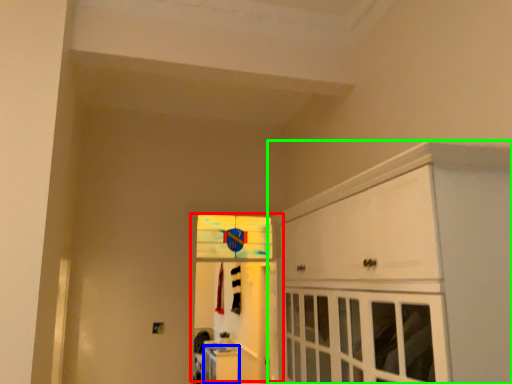
Question: Estimate the real-world distances between objects in this image. Which object is closer to door (highlighted by a red box), cabinetry (highlighted by a blue box) or cabinetry (highlighted by a green box)?

Choices:
 (A) cabinetry
 (B) cabinetry

Answer: (A)